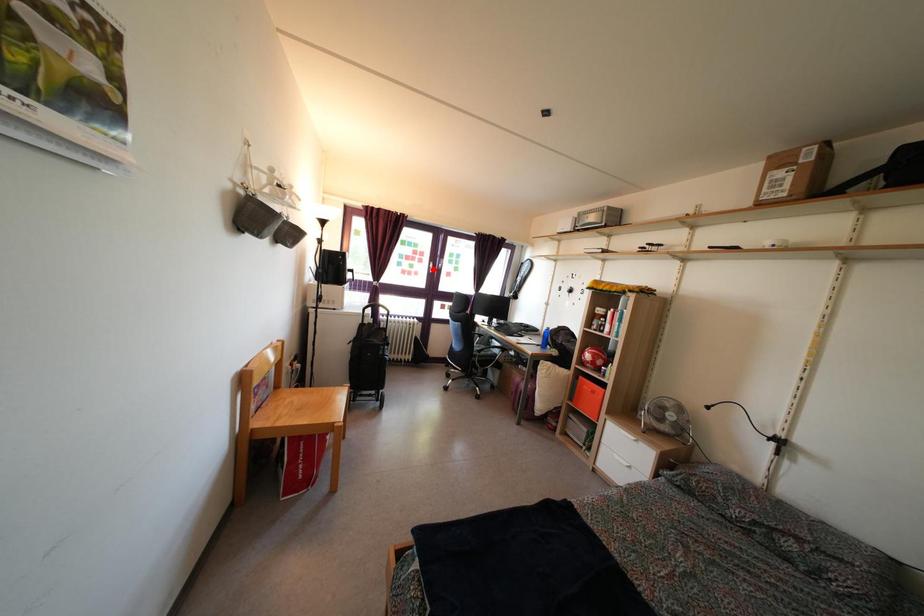
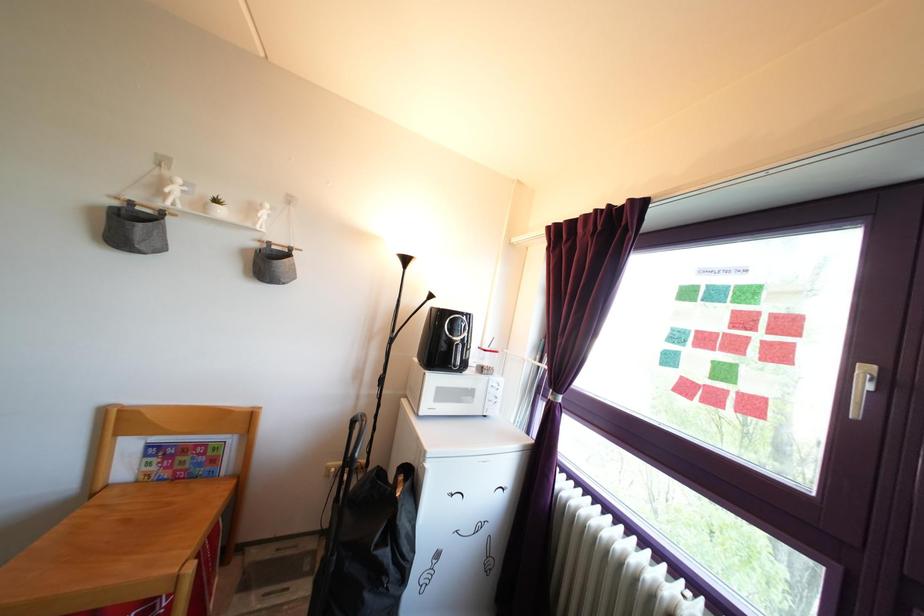
Find the pixel in the second image that matches the highlighted location in the first image.

(857, 365)